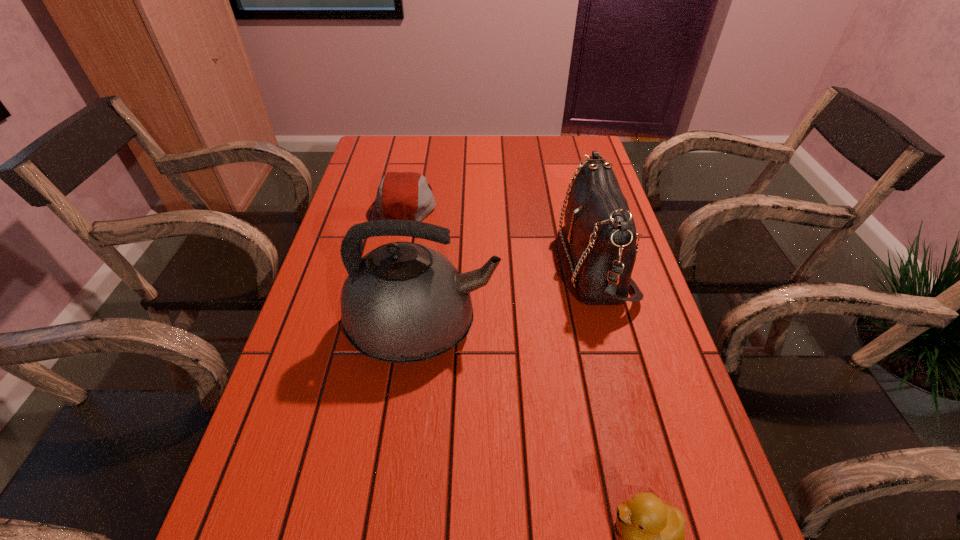
In order to click on kettle in this screenshot , I will do `click(403, 302)`.

Locate an element on the screen. This screenshot has height=540, width=960. handbag is located at coordinates (600, 229).

You are a GUI agent. You are given a task and a screenshot of the screen. Output one action in this format:
    pyautogui.click(x=<x>, y=<y>)
    Task: Click on the cap
    The width and height of the screenshot is (960, 540).
    Given the screenshot: What is the action you would take?
    pyautogui.click(x=400, y=195)

This screenshot has width=960, height=540. I want to click on vacant space located 0.290m at the spout of the kettle, so click(x=628, y=328).

Find the location of a particular element. vacant space located at the front of the handbag with chain and zipper is located at coordinates (488, 262).

You are a GUI agent. You are given a task and a screenshot of the screen. Output one action in this format:
    pyautogui.click(x=<x>, y=<y>)
    Task: Click on the vacant space located at the front of the handbag with chain and zipper
    
    Given the screenshot: What is the action you would take?
    pyautogui.click(x=541, y=262)

Identify the location of vacant area situated 0.370m at the front of the handbag with chain and zipper. (418, 262).

Locate an element on the screen. The image size is (960, 540). vacant space located 0.220m on the front-facing side of the cap is located at coordinates (510, 204).

Find the location of a particular element. This screenshot has width=960, height=540. kettle positioned at the left edge is located at coordinates (403, 302).

Identify the location of cap positioned at the left edge. (400, 195).